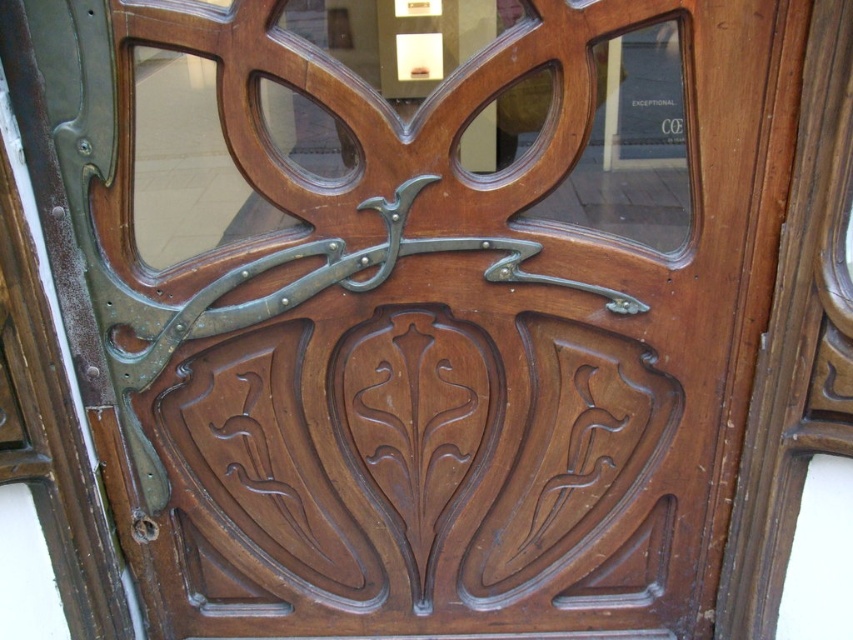
Question: Among these objects, which one is nearest to the camera?

Choices:
 (A) brown carved wood at center
 (B) polished brass door handle at center

Answer: (B)

Question: Which point appears closest to the camera in this image?

Choices:
 (A) (361, 608)
 (B) (567, 280)

Answer: (B)

Question: Can you confirm if brown carved wood at center is bigger than polished brass door handle at center?

Choices:
 (A) no
 (B) yes

Answer: (B)

Question: Does brown carved wood at center lie behind polished brass door handle at center?

Choices:
 (A) no
 (B) yes

Answer: (B)

Question: Which point appears closest to the camera in this image?

Choices:
 (A) (254, 269)
 (B) (642, 467)

Answer: (A)

Question: Is brown carved wood at center to the right of polished brass door handle at center from the viewer's perspective?

Choices:
 (A) yes
 (B) no

Answer: (A)